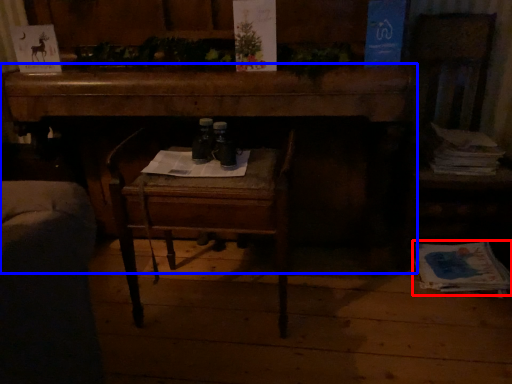
Question: Which point is further to the camera, magazine (highlighted by a red box) or desk (highlighted by a blue box)?

Choices:
 (A) magazine
 (B) desk

Answer: (A)